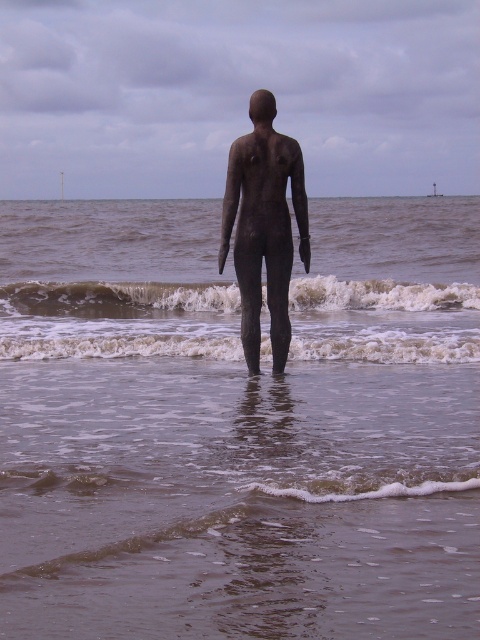
Based on the photo, between brown textured water at center and matte bronze figure at center, which one has more height?

With more height is brown textured water at center.

Can you confirm if brown textured water at center is taller than matte bronze figure at center?

Yes.

Is point (300, 387) farther from camera compared to point (274, 195)?

No, it is in front of (274, 195).

This screenshot has height=640, width=480. I want to click on brown textured water at center, so click(238, 426).

What do you see at coordinates (264, 227) in the screenshot? This screenshot has width=480, height=640. I see `matte bronze figure at center` at bounding box center [264, 227].

Does matte bronze figure at center have a lesser height compared to white foamy wave at center?

No.

Is point (288, 346) less distant than point (98, 355)?

Yes, it is in front of point (98, 355).

Locate an element on the screen. This screenshot has height=640, width=480. matte bronze figure at center is located at coordinates (264, 227).

In the scene shown: Is white frothy wave at center in front of white foamy wave at center?

No, white frothy wave at center is further to the viewer.

Which is more to the right, white frothy wave at center or white foamy wave at center?

Positioned to the right is white foamy wave at center.

Who is more forward, (349, 301) or (357, 352)?

Point (357, 352) is more forward.

Where is `white frothy wave at center`? This screenshot has width=480, height=640. white frothy wave at center is located at coordinates (120, 298).